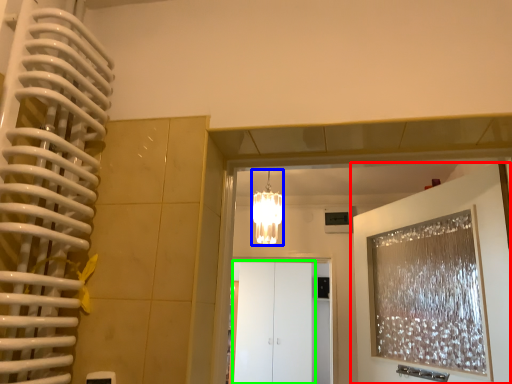
Question: Considering the real-world distances, which object is closest to door (highlighted by a red box)? lamp (highlighted by a blue box) or glass door (highlighted by a green box).

Choices:
 (A) lamp
 (B) glass door

Answer: (A)